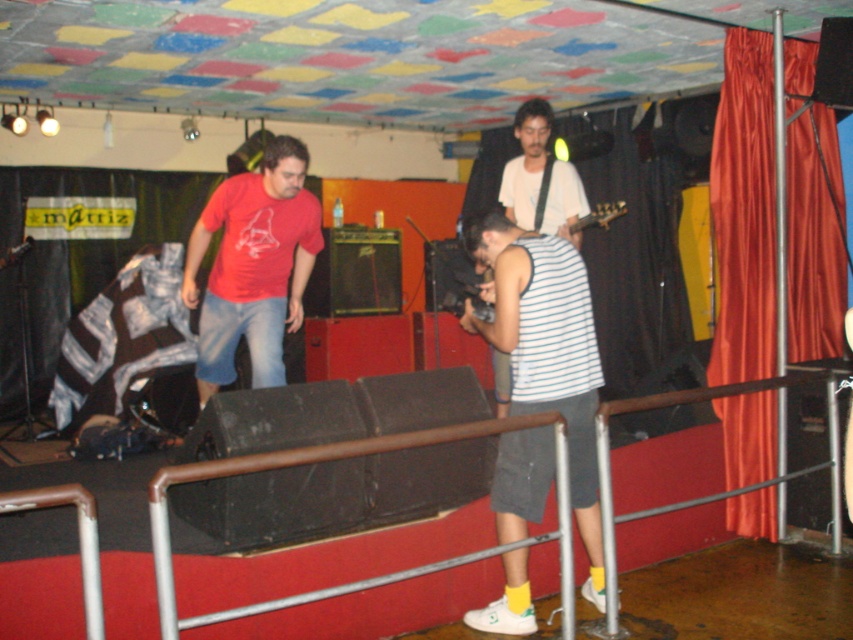
You are standing at the front of the audience, right at the railing near the large black speaker. You want to toss a small object to a friend who is at point [840,289]. Is the distance within your throwing range if you can throw up to 5 meters?

The distance of point [840,289] from viewer is 4.70 meters, so yes, it is within your throwing range since 4.70 meters is less than 5 meters.

You are a stagehand preparing to adjust the lighting. You notice two items on stage that need attention. The metal at center and the white matte shirt at center. Which item requires a larger spotlight to fully illuminate its size?

The metal at center requires a larger spotlight because it has a larger size compared to the white matte shirt at center.